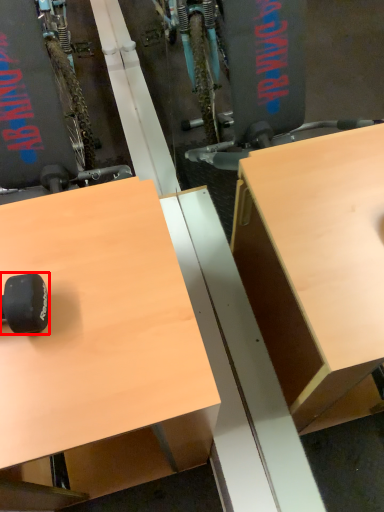
Question: From the image's perspective, what is the correct spatial relationship of wheel (annotated by the red box) in relation to desk?

Choices:
 (A) above
 (B) below

Answer: (A)